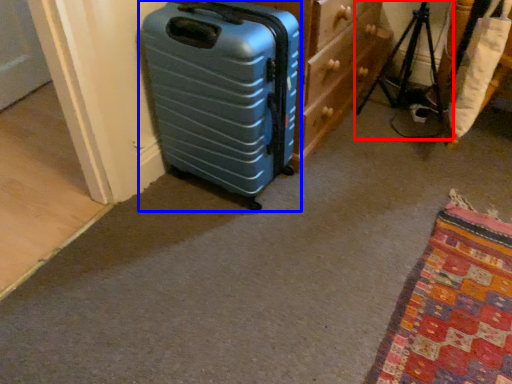
Question: Among these objects, which one is nearest to the camera, tripod (highlighted by a red box) or suitcase (highlighted by a blue box)?

Choices:
 (A) tripod
 (B) suitcase

Answer: (B)